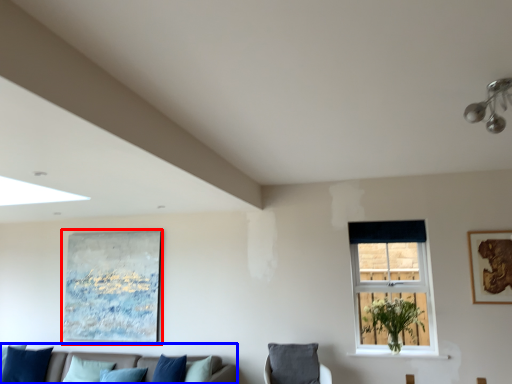
Question: Which object appears closest to the camera in this image, picture frame (highlighted by a red box) or studio couch (highlighted by a blue box)?

Choices:
 (A) picture frame
 (B) studio couch

Answer: (B)